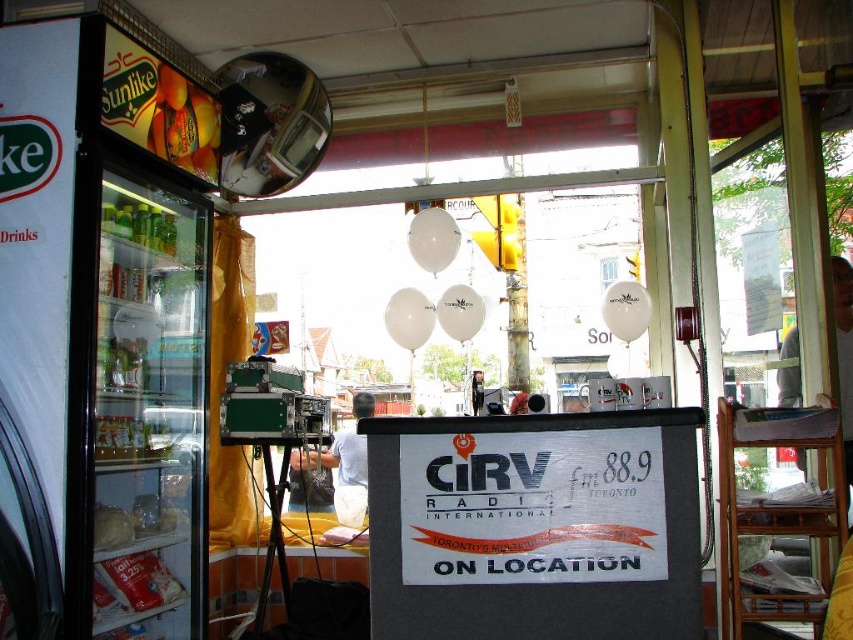
You are standing in the radio station and need to place a new microphone stand. The stand requires a space that is closer to you than the other point. Which point should you choose between point [157,134] and point [351,468]?

You should choose point [157,134] because it is closer to the viewer than point [351,468].

What is located at the coordinates point (183, 124)?

The coordinates point (183, 124) marks the location of shiny plastic oranges at upper left.

From the picture: You are a guest at the radio station and want to place a name tag on your white fabric shirt at center. However, there are shiny plastic oranges at upper left hanging above your head. Will the oranges block the view of your name tag?

The shiny plastic oranges at upper left are positioned over the white fabric shirt at center, so they will block the view of the name tag on the white fabric shirt at center.